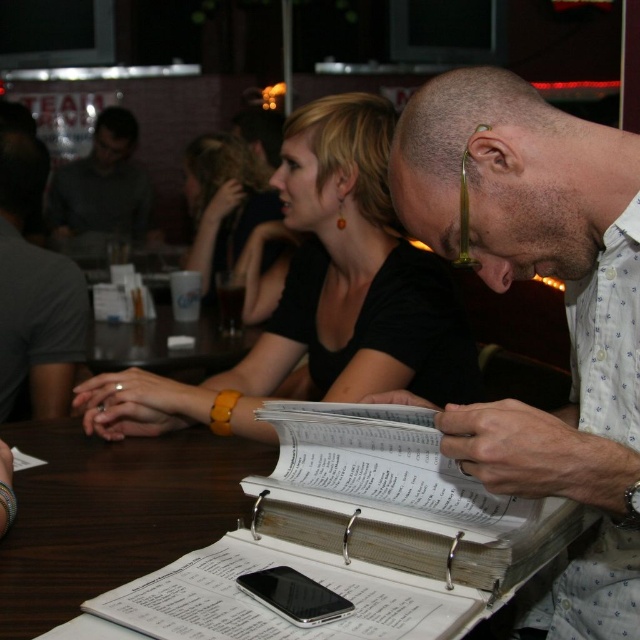
In the scene shown: Is white paper at center above gray fabric shirt at left?

No.

Is white paper at center to the left of gray fabric shirt at left from the viewer's perspective?

No, white paper at center is not to the left of gray fabric shirt at left.

Is point (577, 442) more distant than point (13, 148)?

No, it is not.

Locate an element on the screen. This screenshot has width=640, height=640. white paper at center is located at coordinates (564, 308).

Who is more distant from viewer, (552, 554) or (200, 216)?

Positioned behind is point (200, 216).

I want to click on beige paper book at center, so click(x=397, y=499).

Who is lower down, black matte shirt at center or beige paper book at center?

beige paper book at center is lower down.

Can you confirm if black matte shirt at center is smaller than beige paper book at center?

Incorrect, black matte shirt at center is not smaller in size than beige paper book at center.

Between point (308, 284) and point (461, 484), which one is positioned behind?

The point (308, 284) is behind.

Find the location of a particular element. The image size is (640, 640). black matte shirt at center is located at coordinates (321, 296).